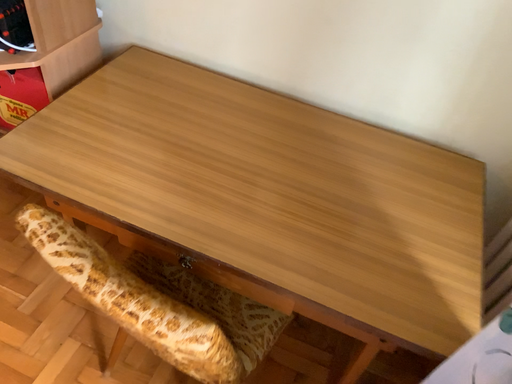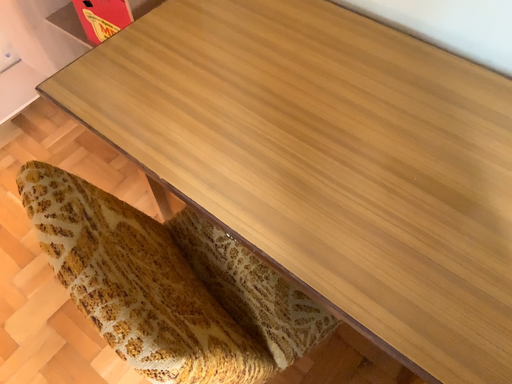
Question: How did the camera likely rotate when shooting the video?

Choices:
 (A) rotated downward
 (B) rotated upward

Answer: (A)